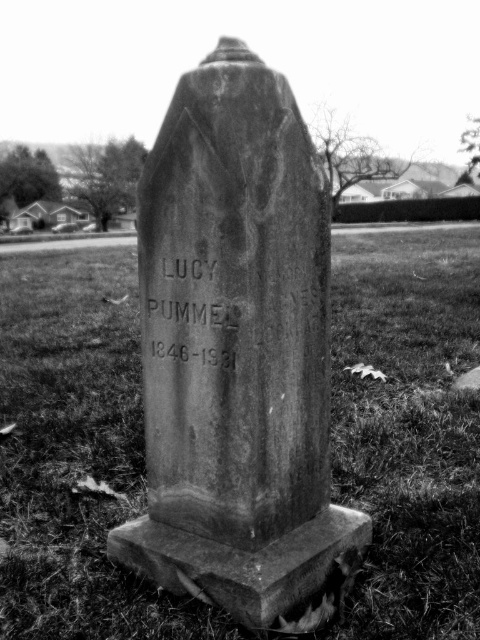
You are a gardener who needs to plant a new flower bed between the grassy at center and the granite gravestone at center. Can you fit a flower bed that is 1.5 meters wide in the space between them?

The grassy at center and granite gravestone at center are 1.27 meters apart, so the flower bed that is 1.5 meters wide cannot fit between them because the space is narrower than the flower bed.

You are standing in a cemetery and see the grassy at center and the granite gravestone at center. Which one is positioned to the left?

The grassy at center is to the left of the granite gravestone at center.

You are standing in a cemetery and see the granite gravestone at center and the grassy at center. Which object is closer to you?

The grassy at center is closer to you because the granite gravestone at center is behind it.